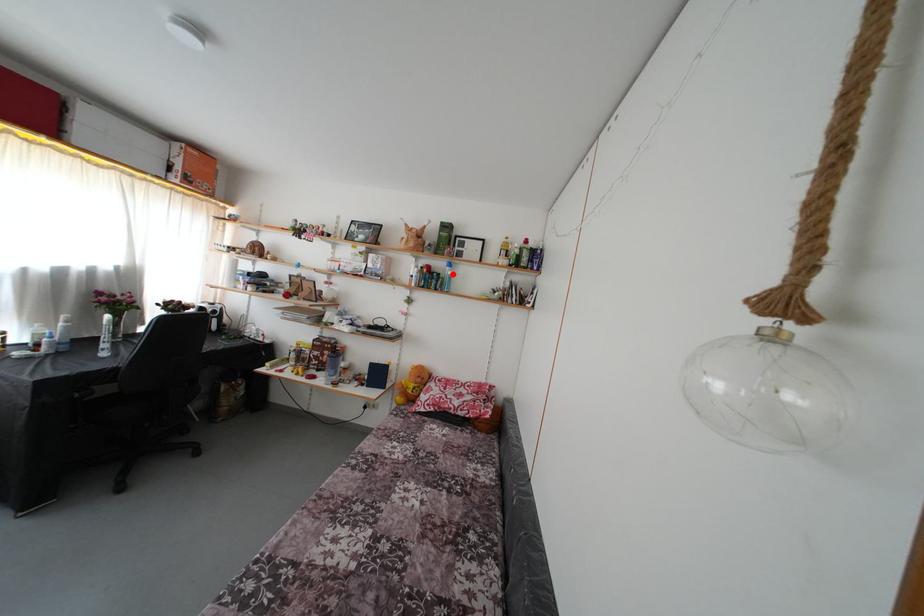
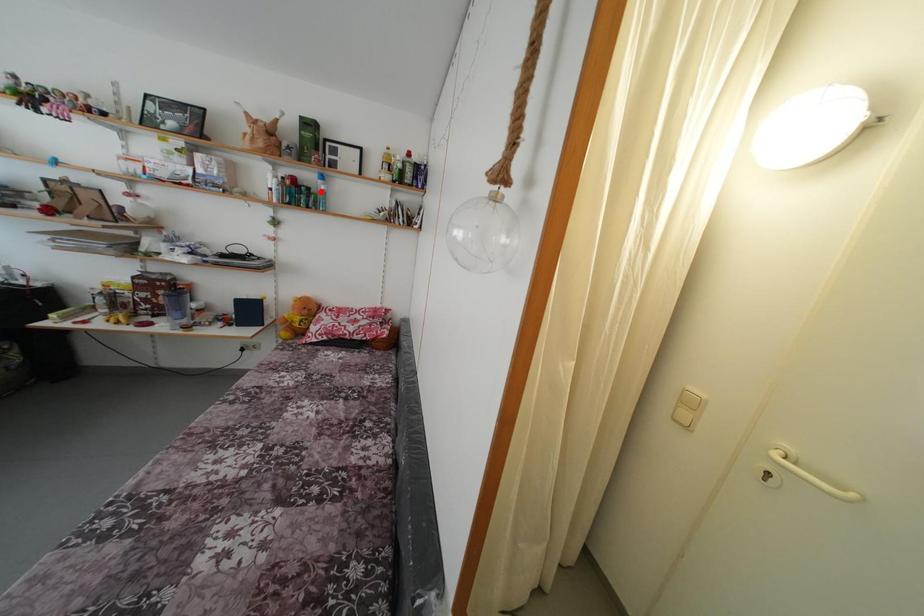
I am providing you with two images of the same scene from different viewpoints. A red point is marked on the first image and another point is marked on the second image. Does the point marked in image1 correspond to the same location as the one in image2?

No